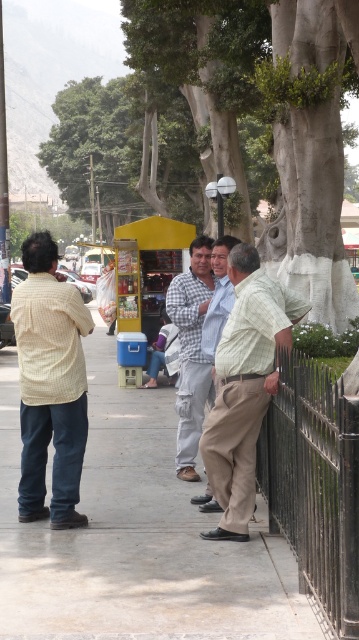
You are a photographer trying to capture a candid shot of the khaki pants at center and light blue shirt at center. Since you want to focus on the lower half of the person, which object should you aim your camera at first?

The khaki pants at center is positioned under the light blue shirt at center, so you should aim your camera at the khaki pants at center first to focus on the lower half.

You are standing at the point marked as point (272, 524) in the image. The distance between you and the viewer is 6.82 meters. You want to throw a ball to the viewer. Is the distance within a typical throwing range for an adult?

The distance between point (272, 524) and the viewer is 6.82 meters. A typical throwing range for an adult is around 10 to 15 meters, so yes, the distance is within a typical throwing range for an adult.